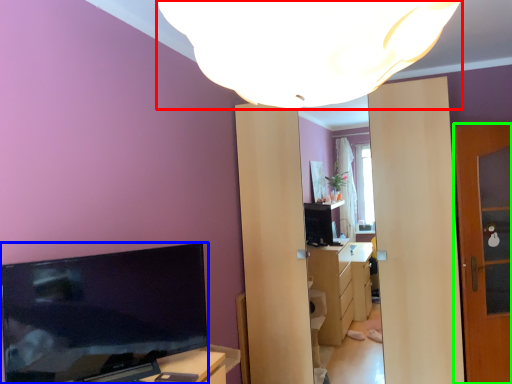
Question: Estimate the real-world distances between objects in this image. Which object is farther from lamp (highlighted by a red box), television (highlighted by a blue box) or door (highlighted by a green box)?

Choices:
 (A) television
 (B) door

Answer: (B)